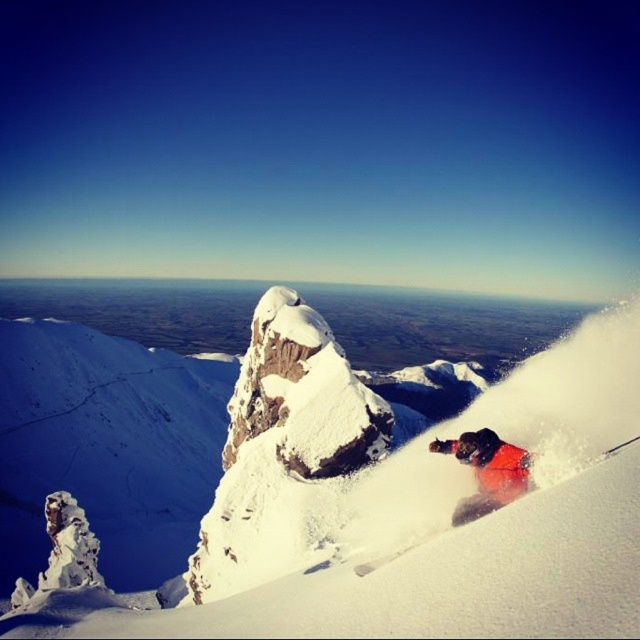
What do you see at coordinates (456, 529) in the screenshot?
I see `white powdery snow at center` at bounding box center [456, 529].

Is white powdery snow at center closer to camera compared to orange snowsuit at lower right?

Yes, white powdery snow at center is in front of orange snowsuit at lower right.

Between point (556, 481) and point (515, 490), which one is positioned in front?

Point (556, 481) is in front.

This screenshot has width=640, height=640. I want to click on white powdery snow at center, so click(x=456, y=529).